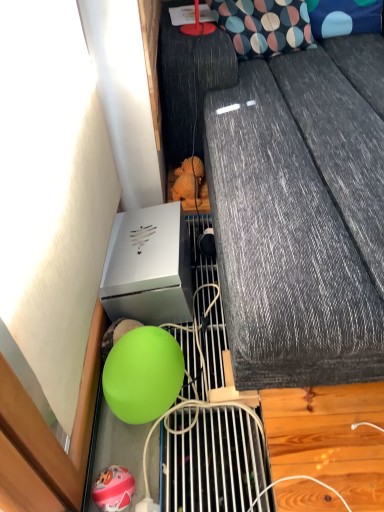
Question: Considering the relative positions of blue dotted fabric pillow at upper right, the 2th pillow when ordered from left to right, and matte green balloon at lower left in the image provided, is blue dotted fabric pillow at upper right, the 2th pillow when ordered from left to right, in front of matte green balloon at lower left?

Choices:
 (A) no
 (B) yes

Answer: (A)

Question: From the image's perspective, is blue dotted fabric pillow at upper right, the 2th pillow when ordered from left to right, below matte green balloon at lower left?

Choices:
 (A) yes
 (B) no

Answer: (B)

Question: From the image's perspective, is blue dotted fabric pillow at upper right, the first pillow when ordered from right to left, above matte green balloon at lower left?

Choices:
 (A) no
 (B) yes

Answer: (B)

Question: Does blue dotted fabric pillow at upper right, the 2th pillow when ordered from left to right, appear on the left side of matte green balloon at lower left?

Choices:
 (A) no
 (B) yes

Answer: (A)

Question: Does blue dotted fabric pillow at upper right, the 2th pillow when ordered from left to right, turn towards matte green balloon at lower left?

Choices:
 (A) yes
 (B) no

Answer: (B)

Question: In terms of size, does matte green balloon at lower left appear bigger or smaller than blue dotted fabric pillow at upper right, the first pillow when ordered from right to left?

Choices:
 (A) small
 (B) big

Answer: (A)

Question: Is matte green balloon at lower left in front of or behind blue dotted fabric pillow at upper right, the 2th pillow when ordered from left to right, in the image?

Choices:
 (A) behind
 (B) front

Answer: (B)

Question: In the image, is matte green balloon at lower left on the left side or the right side of blue dotted fabric pillow at upper right, the first pillow when ordered from right to left?

Choices:
 (A) right
 (B) left

Answer: (B)

Question: Considering the positions of point (132, 480) and point (342, 1), is point (132, 480) closer or farther from the camera than point (342, 1)?

Choices:
 (A) closer
 (B) farther

Answer: (A)

Question: Do you think blue dotted fabric pillow at upper right, the first pillow when ordered from right to left, is within matte green balloon at lower left, or outside of it?

Choices:
 (A) inside
 (B) outside

Answer: (B)

Question: In the image, is blue dotted fabric pillow at upper right, the first pillow when ordered from right to left, positioned in front of or behind matte green balloon at lower left?

Choices:
 (A) behind
 (B) front

Answer: (A)

Question: Considering the positions of point (357, 26) and point (112, 477), is point (357, 26) closer or farther from the camera than point (112, 477)?

Choices:
 (A) farther
 (B) closer

Answer: (A)

Question: Based on their sizes in the image, would you say blue dotted fabric pillow at upper right, the 2th pillow when ordered from left to right, is bigger or smaller than matte green balloon at lower left?

Choices:
 (A) small
 (B) big

Answer: (B)

Question: In terms of size, does blue dotted fabric pillow at upper right, the first pillow when ordered from right to left, appear bigger or smaller than green rubber ball at lower left?

Choices:
 (A) big
 (B) small

Answer: (B)

Question: From their relative heights in the image, would you say blue dotted fabric pillow at upper right, the first pillow when ordered from right to left, is taller or shorter than green rubber ball at lower left?

Choices:
 (A) short
 (B) tall

Answer: (A)